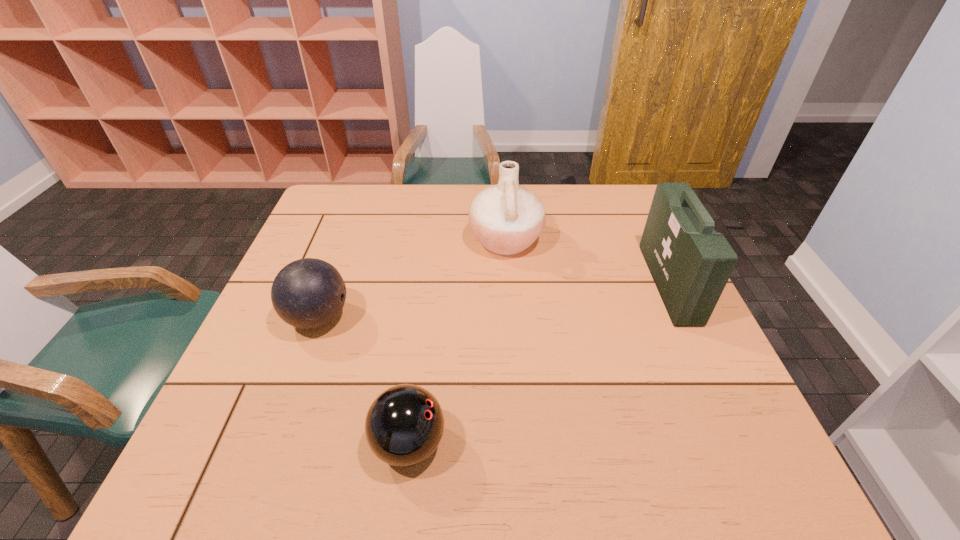
The image size is (960, 540). In order to click on free space at the left edge of the desktop in this screenshot , I will do `click(279, 402)`.

Locate an element on the screen. Image resolution: width=960 pixels, height=540 pixels. vacant space at the right edge of the desktop is located at coordinates (639, 275).

Find the location of a particular element. The height and width of the screenshot is (540, 960). vacant space at the far left corner of the desktop is located at coordinates (324, 197).

Locate an element on the screen. vacant area at the near left corner is located at coordinates (183, 494).

Locate an element on the screen. vacant position at the far right corner of the desktop is located at coordinates (612, 192).

Where is `free space at the near right corner`? free space at the near right corner is located at coordinates (736, 485).

You are a GUI agent. You are given a task and a screenshot of the screen. Output one action in this format:
    pyautogui.click(x=<x>, y=<y>)
    Task: Click on the blank region between the pottery and the right bowling ball
    The width and height of the screenshot is (960, 540).
    Given the screenshot: What is the action you would take?
    pyautogui.click(x=458, y=342)

Image resolution: width=960 pixels, height=540 pixels. Find the location of `empty space between the farther bowling ball and the third object from left to right`. empty space between the farther bowling ball and the third object from left to right is located at coordinates (412, 279).

The image size is (960, 540). What are the coordinates of `unoccupied area between the pottery and the leftmost object` in the screenshot? It's located at (412, 279).

Find the location of a particular element. vacant point located between the shorter bowling ball and the farther bowling ball is located at coordinates (364, 381).